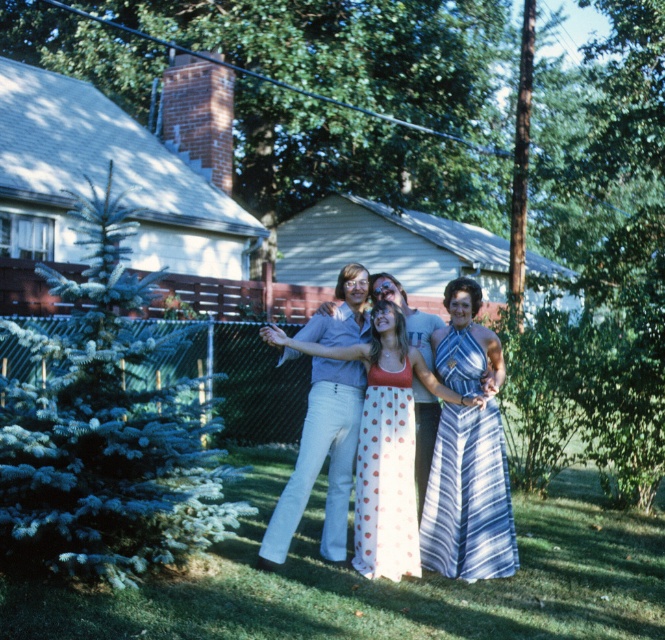
You are a photographer trying to capture a clear shot of both the polka dot dress at center and the blue striped dress at center. Which dress should you focus on to ensure the other is still visible in the background?

The polka dot dress at center is in front of the blue striped dress at center, so you should focus on the polka dot dress at center to ensure the blue striped dress at center remains visible in the background.

You are a photographer trying to capture a clear shot of the polka dot dress at center and the white polka dot fabric dress at center. Which dress should you focus on first if you want to ensure both are in focus, considering their heights?

The polka dot dress at center has a greater height compared to the white polka dot fabric dress at center, so you should focus on the taller polka dot dress at center first to ensure both are in focus.

You are standing at the center of the image and want to move towards the point marked at coordinates [467,497]. What object will you encounter first?

The point at coordinates [467,497] indicates the blue striped dress at center, so you will encounter the blue striped dress at center first.